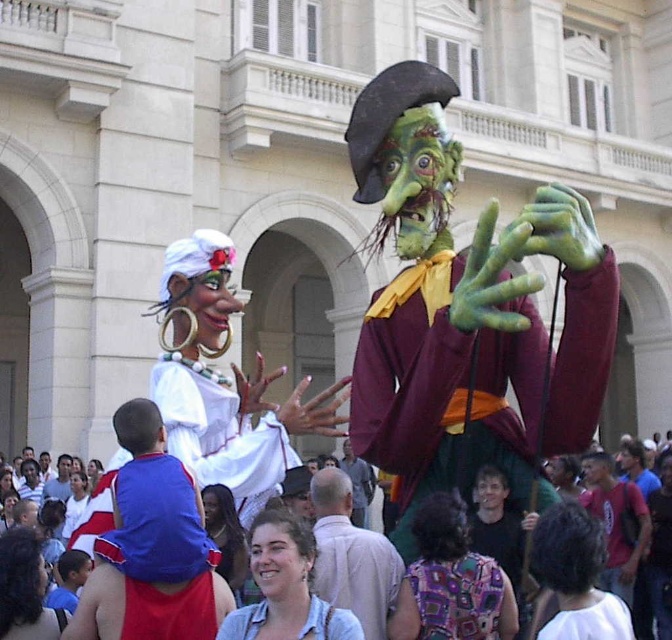
Looking at this image, can you confirm if blue fabric shirt at center is taller than light blue t-shirt at center?

In fact, blue fabric shirt at center may be shorter than light blue t-shirt at center.

Is point (136, 561) farther from camera compared to point (62, 476)?

That is False.

Between point (126, 403) and point (48, 483), which one is positioned in front?

Point (126, 403)

The height and width of the screenshot is (640, 672). I want to click on blue fabric shirt at center, so click(x=151, y=547).

Is blue fabric shirt at center to the right of smooth gray shirt at center from the viewer's perspective?

No, blue fabric shirt at center is not to the right of smooth gray shirt at center.

Is point (151, 524) positioned before point (351, 451)?

Yes, it is.

Which is behind, point (140, 456) or point (343, 472)?

Point (343, 472)

Where is `blue fabric shirt at center`? The height and width of the screenshot is (640, 672). blue fabric shirt at center is located at coordinates (151, 547).

Is point (540, 394) farther from camera compared to point (327, 499)?

No.

Between point (394, 156) and point (378, 609), which one is positioned behind?

The point (394, 156) is more distant.

At what (x,y) coordinates should I click in order to perform the action: click on green matte/maroon fabric at center. Please return your answer as a coordinate pair (x, y). The image size is (672, 640). Looking at the image, I should click on (466, 314).